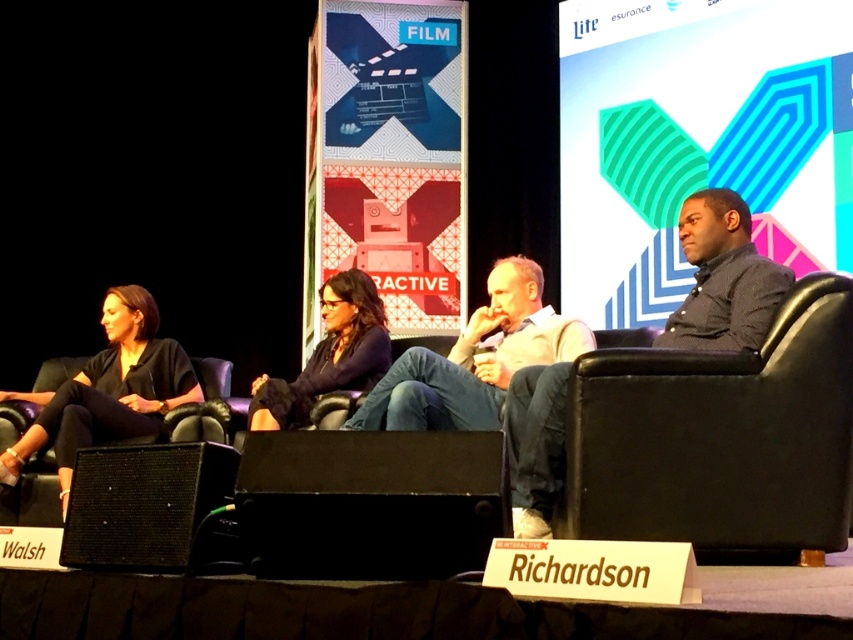
You are an event organizer setting up a camera to capture the panel discussion. You have two points marked for potential camera positions. The first point is at coordinate point[57,401] and the second is at point[335,333]. Based on the scene description, which point is closer to the stage where the panelists are seated?

Point[57,401] is closer to the stage where the panelists are seated because it is closer to the viewer compared to point[335,333].

You are attending a conference and notice two people on stage wearing black matte shirts. The first is labeled as the black matte shirt at left, and the second as the matte black shirt at center. From your perspective as an audience member, which one is positioned lower in the image?

The black matte shirt at left is located below matte black shirt at center, so from the audience perspective, the black matte shirt at left is positioned lower in the image.